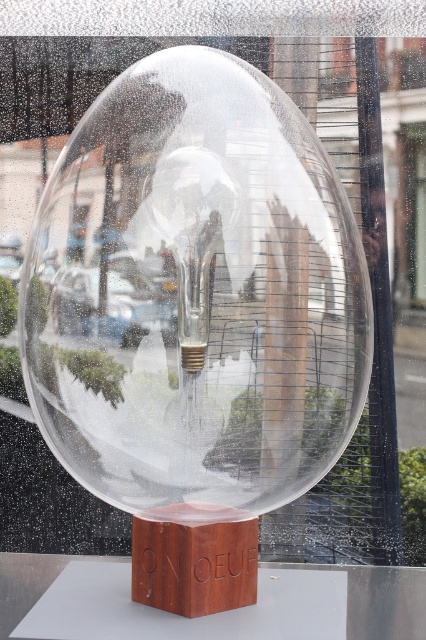
Can you confirm if transparent glass bubble at center is bigger than wooden cube at center?

Yes, transparent glass bubble at center is bigger than wooden cube at center.

Is the position of transparent glass bubble at center more distant than that of wooden cube at center?

No.

Find the location of a particular element. transparent glass bubble at center is located at coordinates (195, 292).